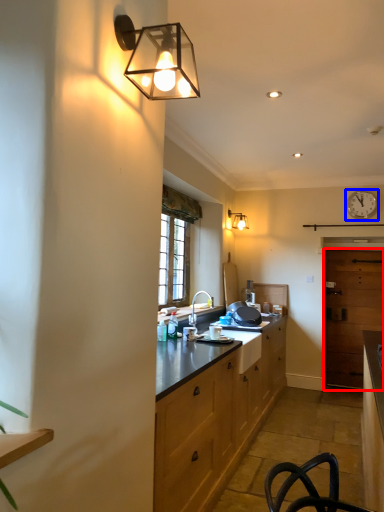
Question: Which object appears farthest to the camera in this image, glass door (highlighted by a red box) or clock (highlighted by a blue box)?

Choices:
 (A) glass door
 (B) clock

Answer: (A)